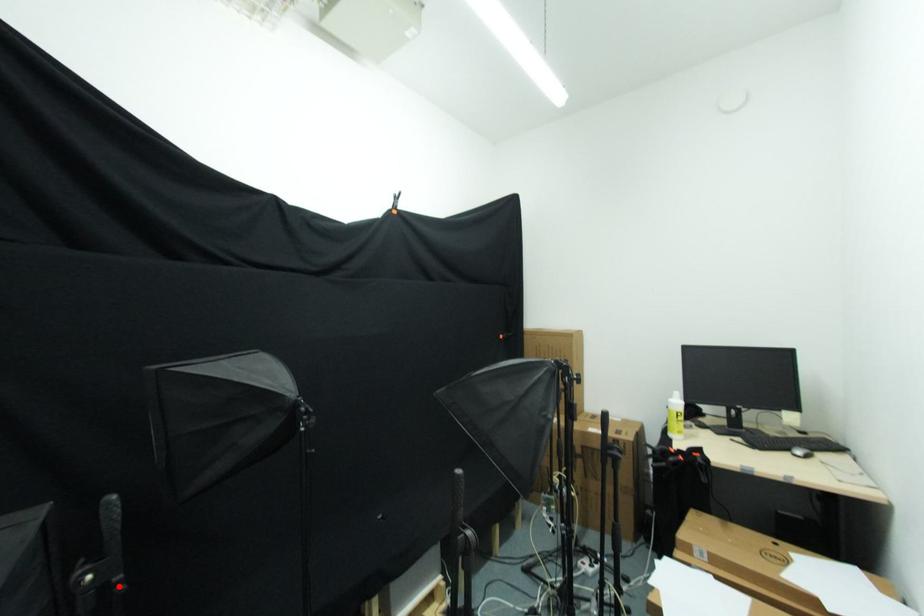
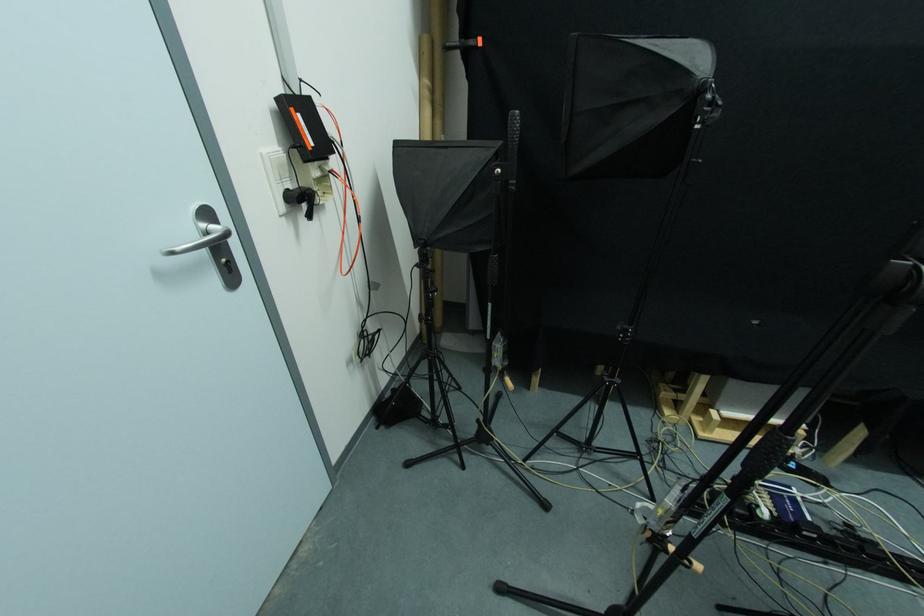
Question: A red point is marked in image1. In image2, is the corresponding 3D point closer to the camera or farther? Reply with the corresponding letter.

Choices:
 (A) The corresponding 3D point is closer.
 (B) The corresponding 3D point is farther.

Answer: (B)